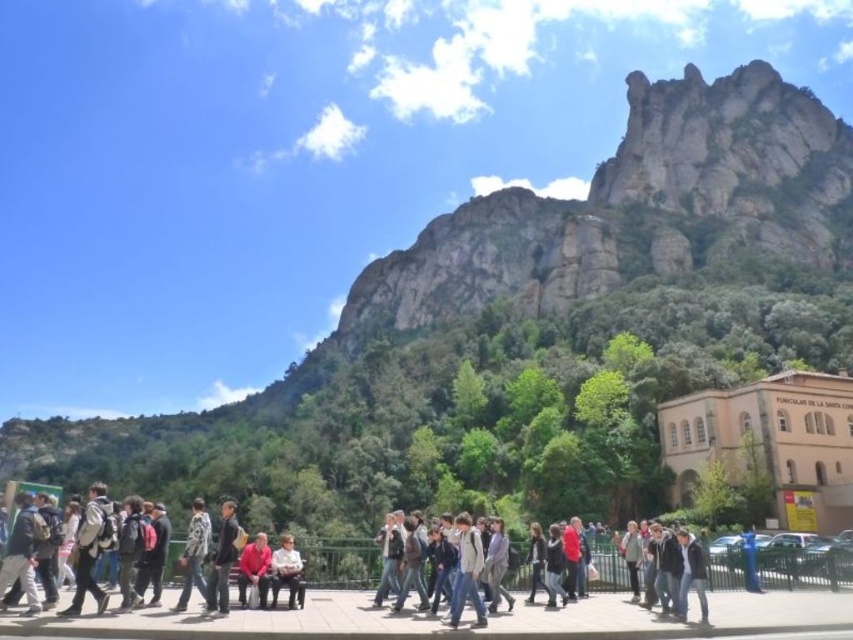
You are a photographer standing on the walkway and want to capture both the light brown leather jacket at center and the dark gray sweater at center in a single photo. Which clothing item will appear closer to the bottom of the photo?

The light brown leather jacket at center is positioned under the dark gray sweater at center, so it will appear closer to the bottom of the photo.

You are a photographer standing at the front of the walkway. You want to take a photo that includes both the light brown leather jacket at center and the dark gray sweater at center. Which one should you adjust your camera angle to focus on first to ensure both are in the frame?

The light brown leather jacket at center is in front of the dark gray sweater at center, so you should focus on the light brown leather jacket at center first to ensure it doesn not block the view of the dark gray sweater at center.

You are standing at the tourist spot near the mountain. You see a person wearing a matte red shirt at center. If you want to take a photo of them from where you are standing, will you need a zoom lens to capture their entire body in the frame?

The matte red shirt at center is 78.60 feet away from viewer. Since the distance is quite far, you would likely need a zoom lens to ensure the entire body of the person in the matte red shirt at center is captured in the frame.